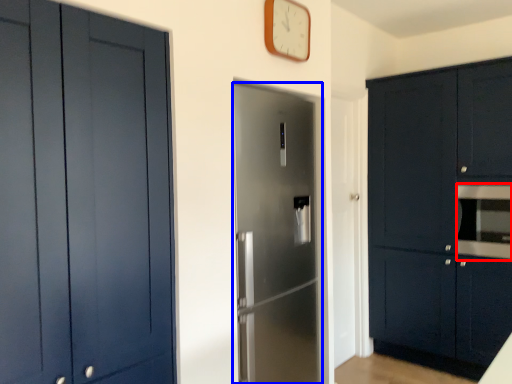
Question: Among these objects, which one is farthest to the camera, oven (highlighted by a red box) or door (highlighted by a blue box)?

Choices:
 (A) oven
 (B) door

Answer: (A)